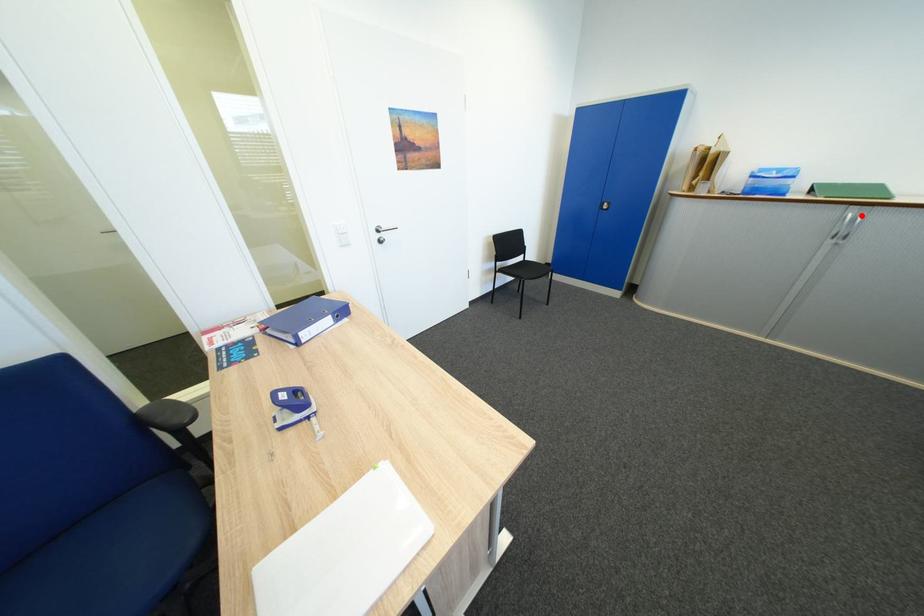
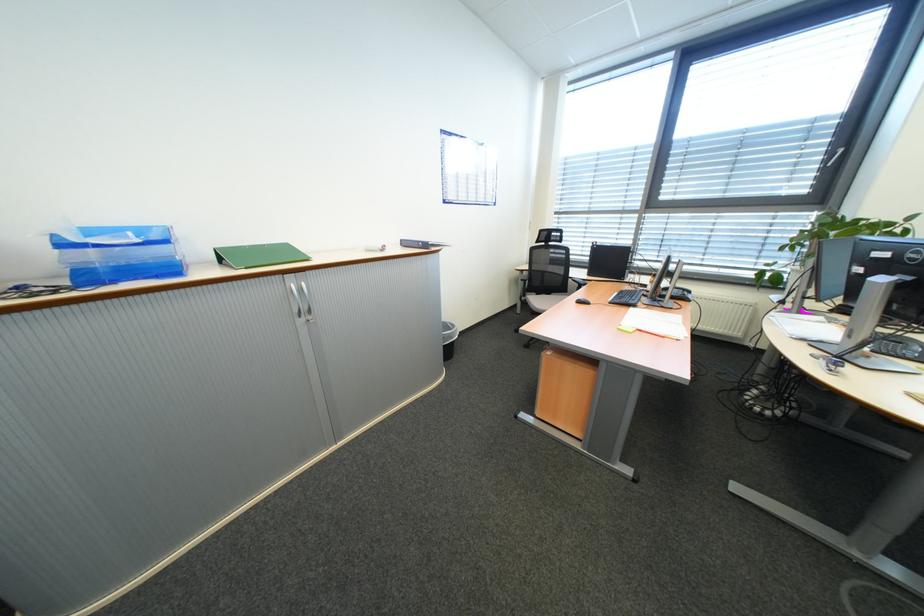
Question: I am providing you with two images of the same scene from different viewpoints. A red point is marked on the first image. At the location where the point appears in image 1, is it still visible in image 2?

Choices:
 (A) Yes
 (B) No

Answer: (A)